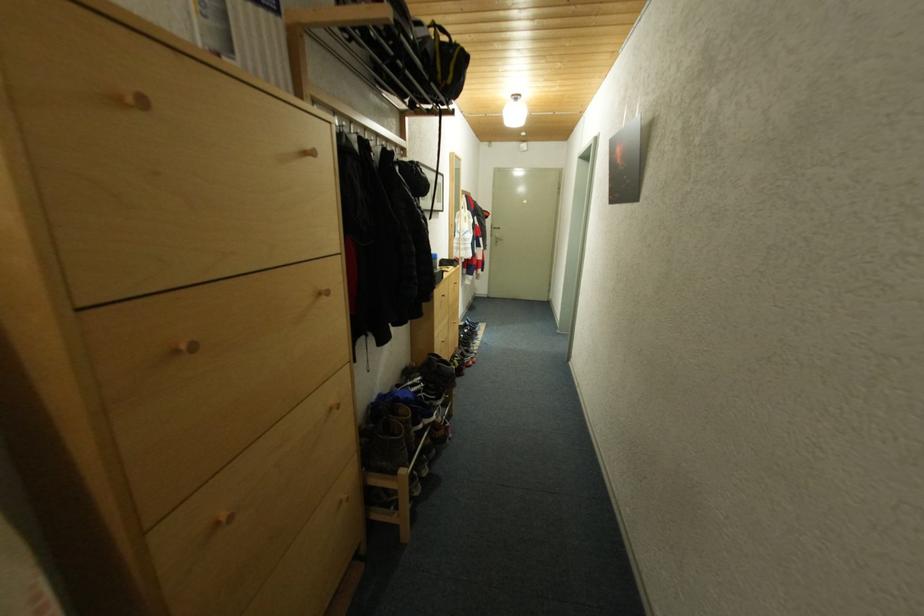
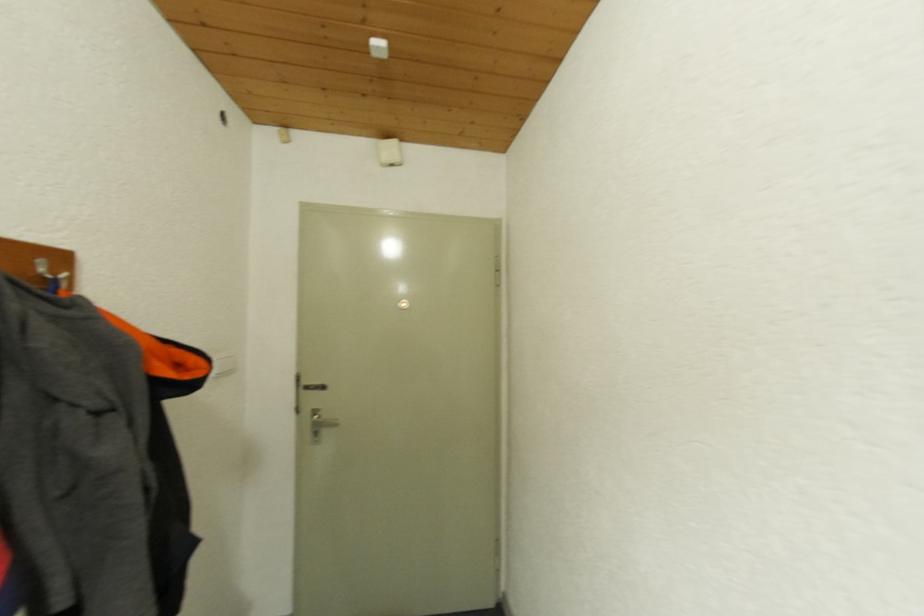
Question: What movement of the cameraman would produce the second image?

Choices:
 (A) Left
 (B) Right
 (C) Forward
 (D) Backward

Answer: (C)